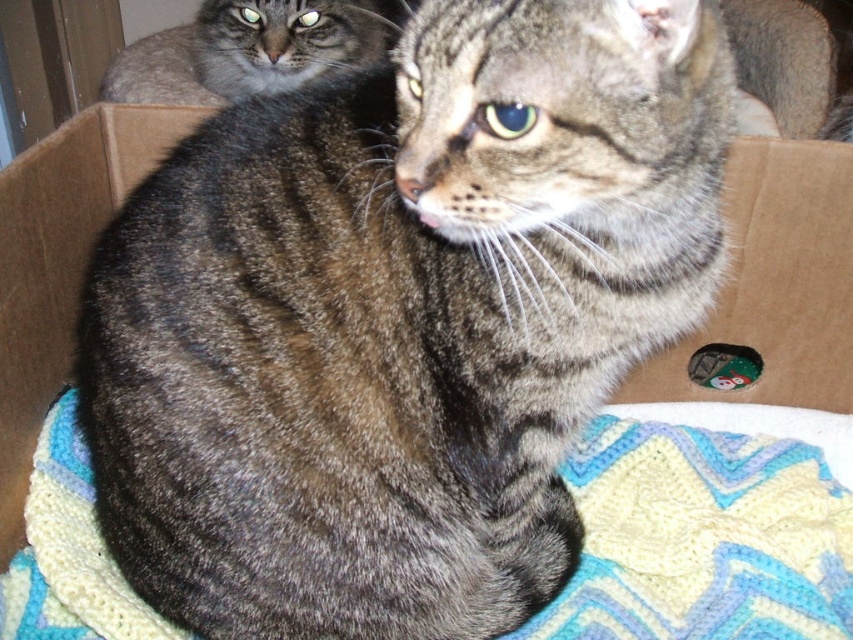
Who is higher up, brown cardboard box at upper left or tabby fur cat at upper left?

tabby fur cat at upper left is higher up.

How much distance is there between brown cardboard box at upper left and tabby fur cat at upper left?

They are 74.96 centimeters apart.

Who is more forward, [16,284] or [273,48]?

Point [16,284]

Locate an element on the screen. brown cardboard box at upper left is located at coordinates (59, 264).

Does brown cardboard box at center appear over brown cardboard box at upper left?

Yes.

Is point (756, 164) farther from camera compared to point (32, 300)?

That is True.

Is point (785, 397) closer to camera compared to point (33, 333)?

No, it is behind (33, 333).

Image resolution: width=853 pixels, height=640 pixels. Identify the location of brown cardboard box at center. (773, 285).

Does brown cardboard box at center appear on the left side of tabby fur cat at upper left?

In fact, brown cardboard box at center is to the right of tabby fur cat at upper left.

How distant is brown cardboard box at center from tabby fur cat at upper left?

1.09 meters

Where is `brown cardboard box at center`? The width and height of the screenshot is (853, 640). brown cardboard box at center is located at coordinates (773, 285).

Where is `brown cardboard box at center`? brown cardboard box at center is located at coordinates (773, 285).